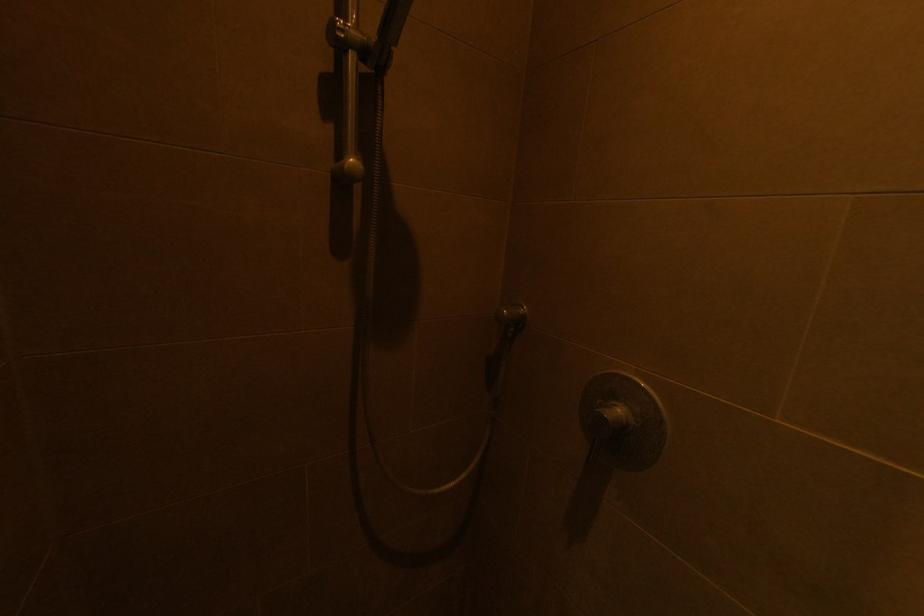
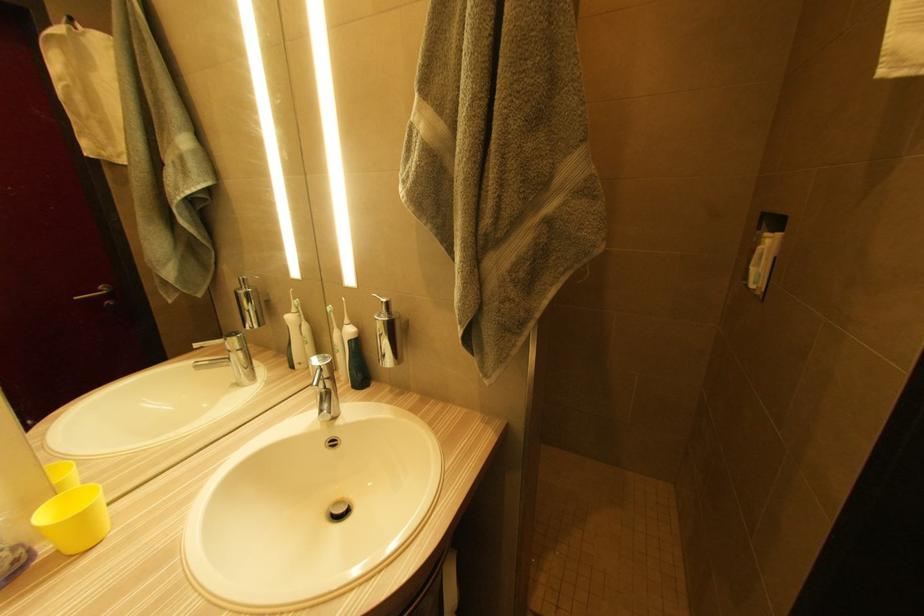
Consider the image. The images are taken continuously from a first-person perspective. In which direction are you moving?

The cameraman walked toward left, backward.